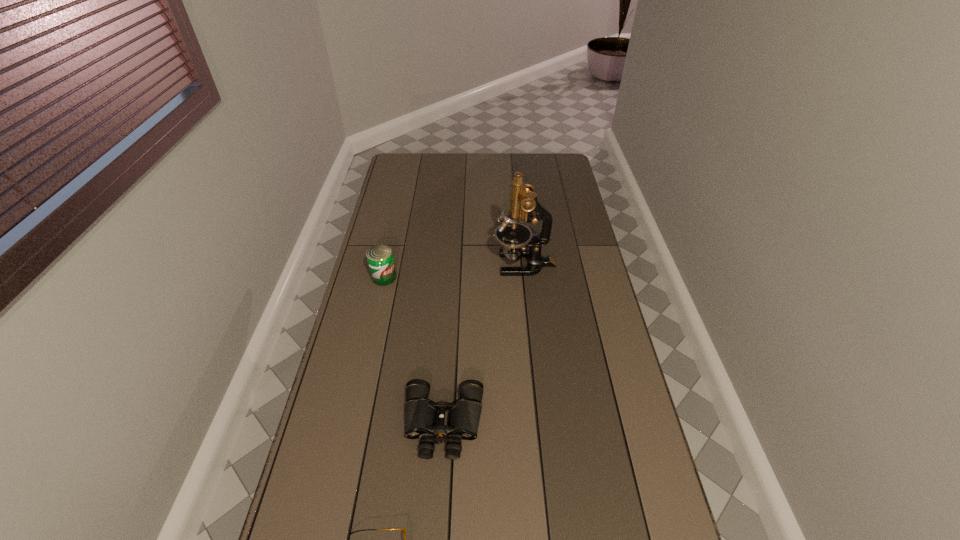
Where is `free space between the can and the tallest object`? This screenshot has height=540, width=960. free space between the can and the tallest object is located at coordinates (454, 271).

Image resolution: width=960 pixels, height=540 pixels. What are the coordinates of `free spot between the microscope and the can` in the screenshot? It's located at (454, 271).

The height and width of the screenshot is (540, 960). Find the location of `blank region between the second shortest object and the can`. blank region between the second shortest object and the can is located at coordinates (414, 350).

Locate an element on the screen. vacant space that is in between the microscope and the second tallest object is located at coordinates (454, 271).

This screenshot has height=540, width=960. Find the location of `object that stands as the closest to the second tallest object`. object that stands as the closest to the second tallest object is located at coordinates (515, 237).

Point out which object is positioned as the second nearest to the third tallest object. Please provide its 2D coordinates. Your answer should be formatted as a tuple, i.e. [(x, y)], where the tuple contains the x and y coordinates of a point satisfying the conditions above.

[(380, 259)]

Where is `free region that satisfies the following two spatial constraints: 1. at the eyepiece of the microscope; 2. through the eyepieces of the second shortest object`? free region that satisfies the following two spatial constraints: 1. at the eyepiece of the microscope; 2. through the eyepieces of the second shortest object is located at coordinates (541, 424).

Where is `blank area in the image that satisfies the following two spatial constraints: 1. at the eyepiece of the microscope; 2. through the eyepieces of the second shortest object`? The image size is (960, 540). blank area in the image that satisfies the following two spatial constraints: 1. at the eyepiece of the microscope; 2. through the eyepieces of the second shortest object is located at coordinates (541, 424).

The height and width of the screenshot is (540, 960). In order to click on free space that satisfies the following two spatial constraints: 1. at the eyepiece of the rightmost object; 2. through the eyepieces of the second shortest object in this screenshot , I will do `click(541, 424)`.

Find the location of a particular element. free location that satisfies the following two spatial constraints: 1. at the eyepiece of the microscope; 2. through the eyepieces of the third tallest object is located at coordinates pos(541,424).